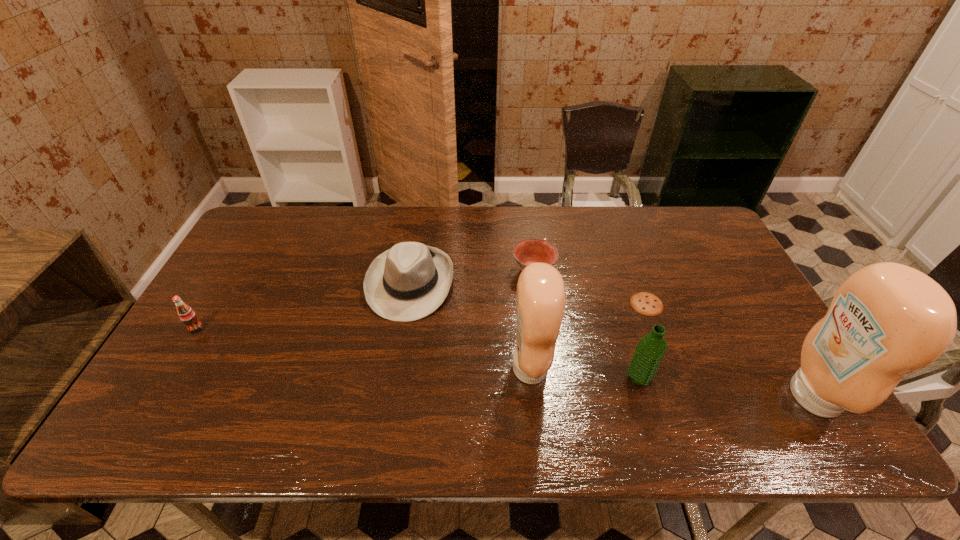
Identify the location of vacant space that satisfies the following two spatial constraints: 1. on the back side of the shortest object; 2. on the right side of the fourth nearest object. (210, 304).

Where is `free space that satisfies the following two spatial constraints: 1. on the label of the third object from right to left; 2. on the left side of the left condiment`? free space that satisfies the following two spatial constraints: 1. on the label of the third object from right to left; 2. on the left side of the left condiment is located at coordinates (532, 377).